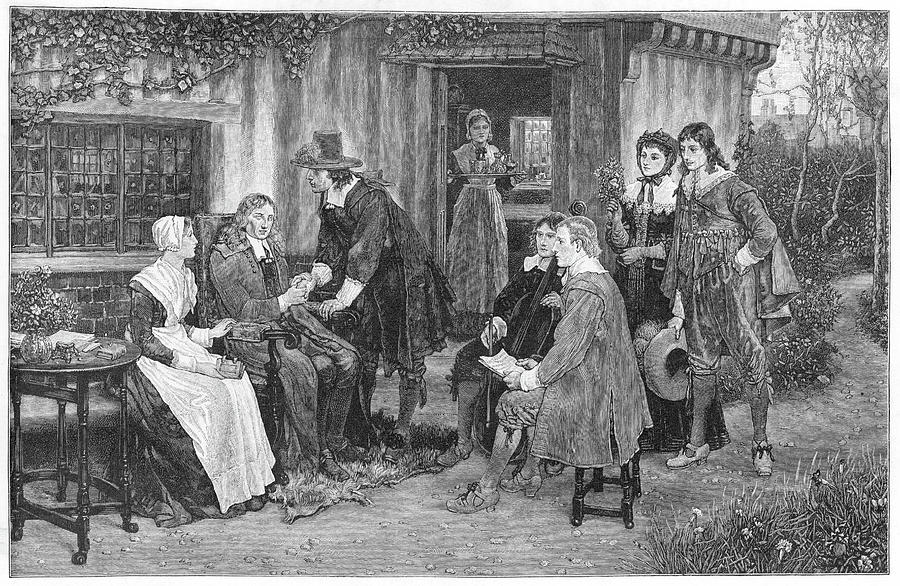
The image size is (900, 586). Identify the location of window. (118, 205).